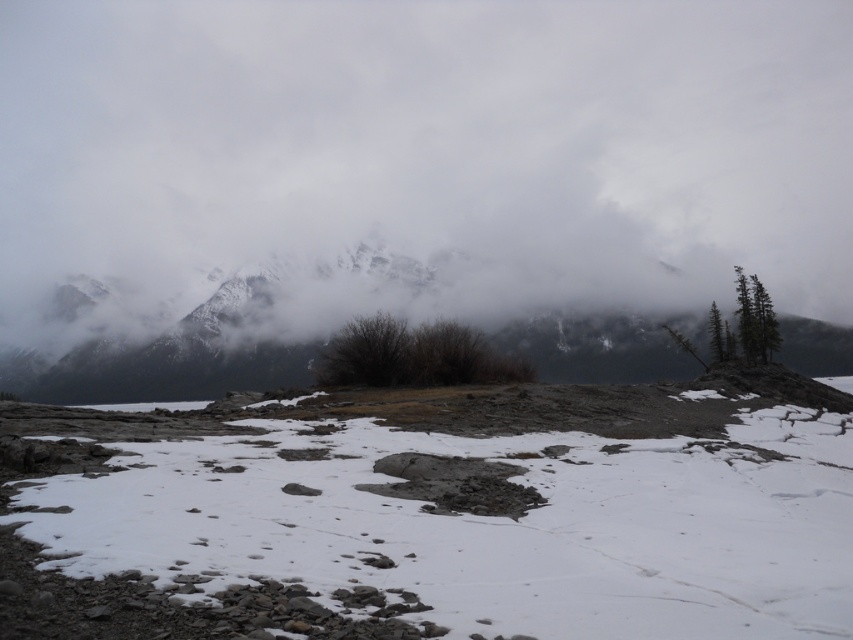
You are an airplane passenger looking out the window and see the white fluffy cloud at upper center and the green matte tree at right. Which object is higher in the sky?

The white fluffy cloud at upper center is higher in the sky than the green matte tree at right because it is positioned over the tree.

You are standing at the point with coordinates point (669, 330) and want to walk towards the mountain range in the background. Is the point (288, 214) blocking your path?

Point (288, 214) is behind point (669, 330), so it is not blocking your path.